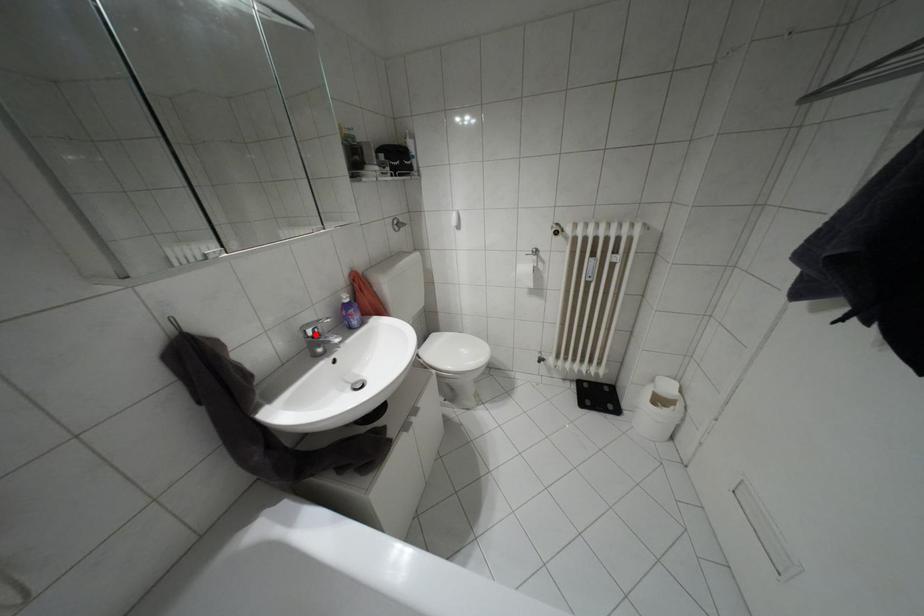
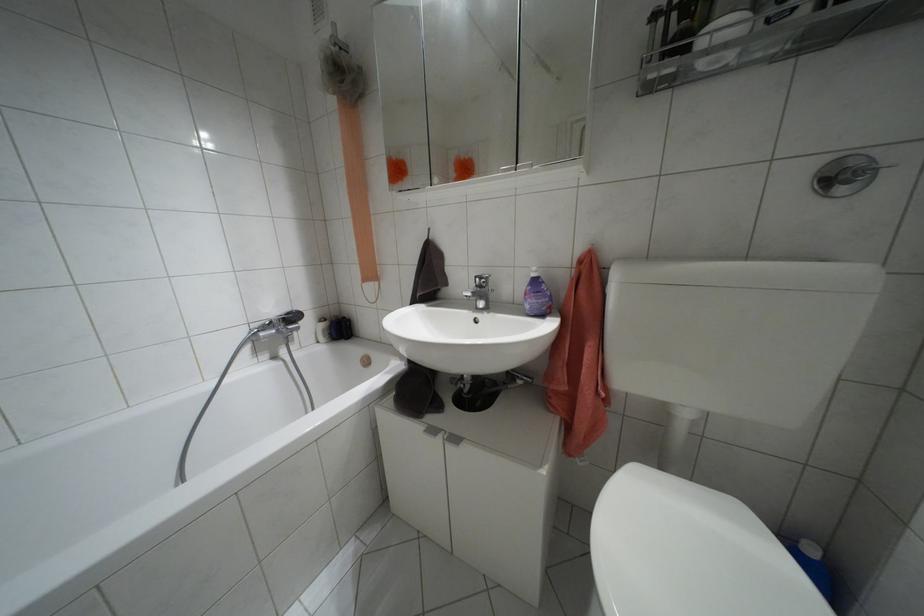
The point at the highlighted location is marked in the first image. Where is the corresponding point in the second image?

(479, 286)